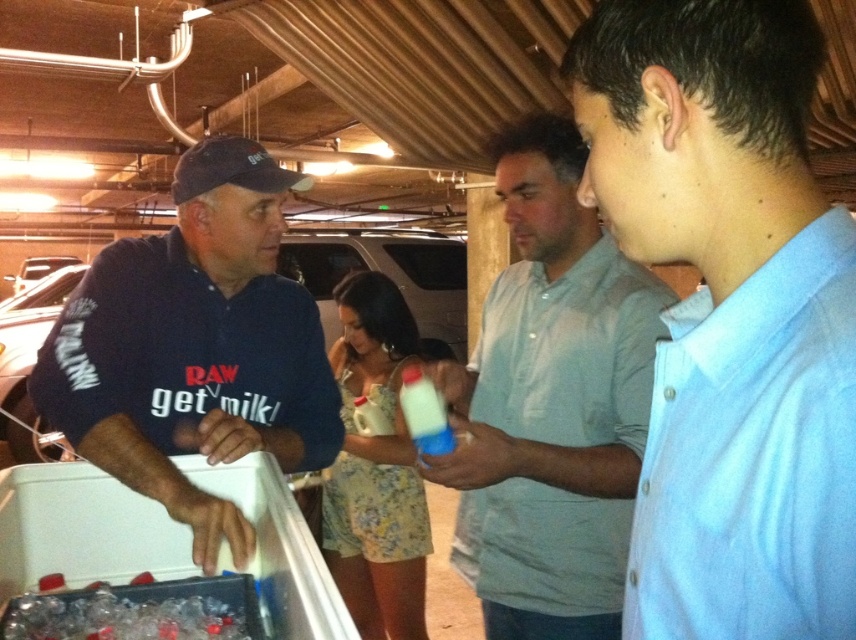
You are a photographer trying to capture a candid shot of the two men in the scene. Since you want to include both the dark blue polo shirt at left and the translucent plastic bottle at center in the frame, which direction should you position yourself relative to the subjects to ensure both are visible?

You should position yourself to the right of the subjects because the dark blue polo shirt at left is to the left of the translucent plastic bottle at center, so placing yourself to the right would allow both objects to be in the frame.